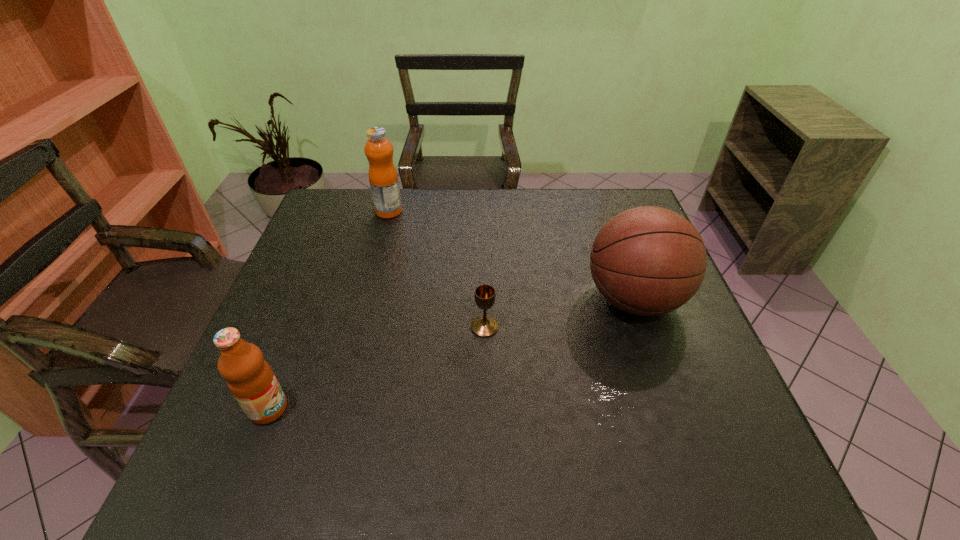
Locate an element on the screen. free space between the farthest object and the nearer fruit juice is located at coordinates (328, 310).

Locate an element on the screen. free spot between the shorter fruit juice and the rightmost object is located at coordinates (451, 354).

Where is `empty space that is in between the rightmost object and the farthest object`? This screenshot has width=960, height=540. empty space that is in between the rightmost object and the farthest object is located at coordinates (511, 255).

Locate an element on the screen. The image size is (960, 540). vacant space that is in between the leftmost object and the rightmost object is located at coordinates (451, 354).

Identify the location of unoccupied position between the nearer fruit juice and the rightmost object. (451, 354).

Locate an element on the screen. This screenshot has height=540, width=960. free space that is in between the leftmost object and the basketball is located at coordinates (451, 354).

This screenshot has width=960, height=540. Find the location of `empty location between the shortest object and the taller fruit juice`. empty location between the shortest object and the taller fruit juice is located at coordinates pos(437,269).

Where is `blank region between the third object from left to right and the nearest object`? This screenshot has height=540, width=960. blank region between the third object from left to right and the nearest object is located at coordinates (376, 368).

Locate an element on the screen. The width and height of the screenshot is (960, 540). vacant region between the shortest object and the rightmost object is located at coordinates (559, 313).

Identify the location of free spot between the rightmost object and the second object from left to right. This screenshot has height=540, width=960. (511, 255).